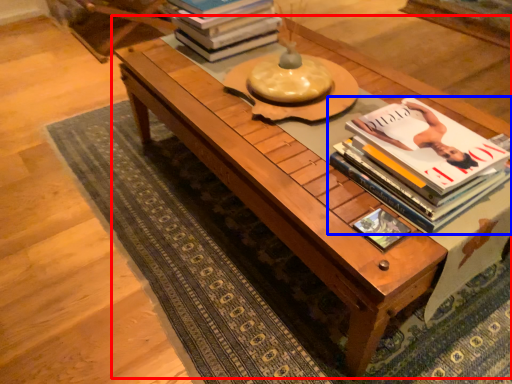
Question: Which of the following is the farthest to the observer, table (highlighted by a red box) or book (highlighted by a blue box)?

Choices:
 (A) table
 (B) book

Answer: (B)